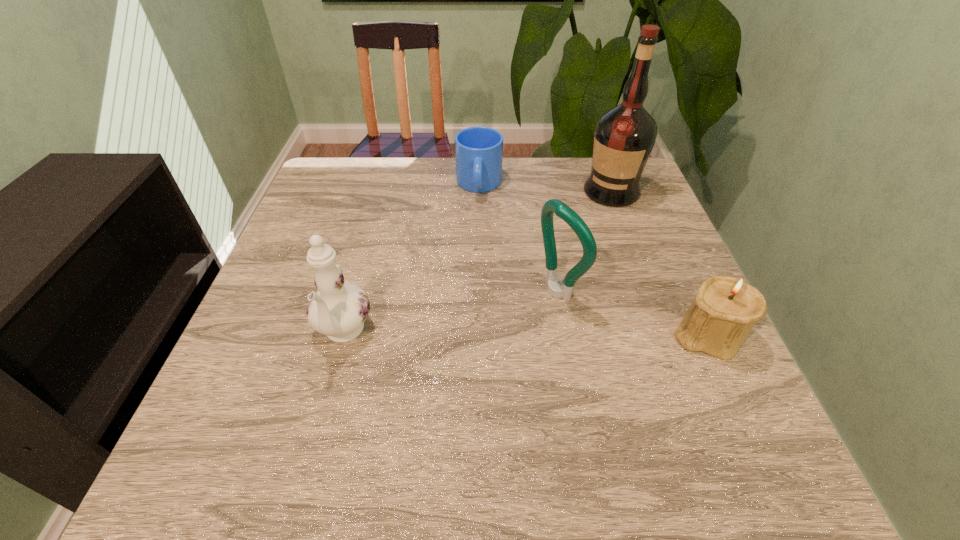
Locate an element on the screen. liquor that is at the right edge is located at coordinates (624, 136).

Find the location of `object that is at the far right corner`. object that is at the far right corner is located at coordinates (624, 136).

Image resolution: width=960 pixels, height=540 pixels. I want to click on free space at the far edge of the desktop, so click(377, 200).

This screenshot has height=540, width=960. In order to click on vacant position at the near edge of the desktop in this screenshot , I will do `click(645, 380)`.

This screenshot has width=960, height=540. I want to click on free space at the left edge, so click(296, 251).

Where is `vacant point at the right edge`? This screenshot has width=960, height=540. vacant point at the right edge is located at coordinates (640, 324).

At what (x,y) coordinates should I click in order to perform the action: click on vacant space at the far left corner of the desktop. Please return your answer as a coordinate pair (x, y). This screenshot has height=540, width=960. Looking at the image, I should click on (344, 171).

Image resolution: width=960 pixels, height=540 pixels. In the image, there is a desktop. Identify the location of vacant space at the near left corner. (250, 385).

Locate an element on the screen. The width and height of the screenshot is (960, 540). free point between the chinaware and the third object from left to right is located at coordinates (450, 312).

You are a GUI agent. You are given a task and a screenshot of the screen. Output one action in this format:
    pyautogui.click(x=<x>, y=<y>)
    Task: Click on the empty space between the liquor and the second object from left to right
    Image resolution: width=960 pixels, height=540 pixels.
    Given the screenshot: What is the action you would take?
    pyautogui.click(x=545, y=188)